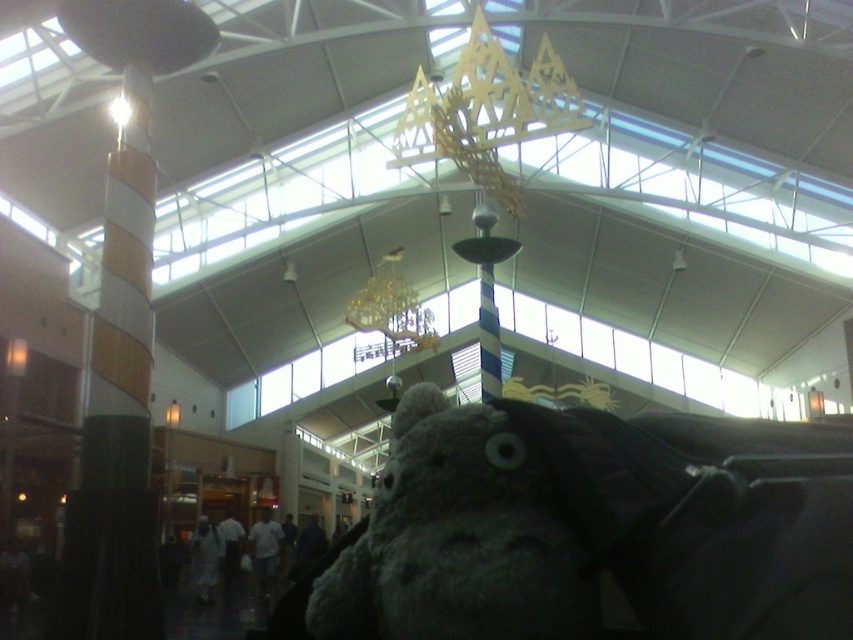
Question: Is gray plush toy at center above striped wood pillar at left?

Choices:
 (A) no
 (B) yes

Answer: (A)

Question: Can you confirm if gray plush toy at center is thinner than striped wood pillar at left?

Choices:
 (A) no
 (B) yes

Answer: (B)

Question: Which of the following is the farthest from the observer?

Choices:
 (A) striped wood pillar at left
 (B) gray plush toy at center

Answer: (A)

Question: Is gray plush toy at center further to the viewer compared to striped wood pillar at left?

Choices:
 (A) no
 (B) yes

Answer: (A)

Question: Among these objects, which one is nearest to the camera?

Choices:
 (A) striped wood pillar at left
 (B) gray plush toy at center

Answer: (B)

Question: Which point is closer to the camera taking this photo?

Choices:
 (A) (519, 493)
 (B) (143, 237)

Answer: (A)